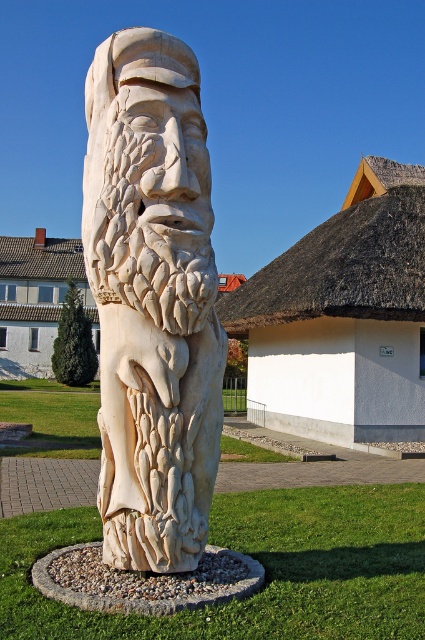
Can you confirm if white carved wood statue at center is smaller than white tiled roof at upper center?

Yes, white carved wood statue at center is smaller than white tiled roof at upper center.

Is point (147, 104) more distant than point (48, 273)?

No, (147, 104) is closer to viewer.

Where is `white carved wood statue at center`? white carved wood statue at center is located at coordinates click(x=152, y=300).

Can you confirm if white thatched roof at upper center is taller than white tiled roof at upper center?

In fact, white thatched roof at upper center may be shorter than white tiled roof at upper center.

Is point (416, 372) closer to viewer compared to point (34, 282)?

Yes, it is.

Which is in front, point (294, 388) or point (61, 292)?

Point (294, 388) is in front.

The height and width of the screenshot is (640, 425). In order to click on white thatched roof at upper center in this screenshot , I will do `click(342, 316)`.

Is white carved wood statue at center taller than white thatched roof at upper center?

No, white carved wood statue at center is not taller than white thatched roof at upper center.

Describe the element at coordinates (152, 300) in the screenshot. Image resolution: width=425 pixels, height=640 pixels. I see `white carved wood statue at center` at that location.

At what (x,y) coordinates should I click in order to perform the action: click on white carved wood statue at center. Please return your answer as a coordinate pair (x, y). This screenshot has width=425, height=640. Looking at the image, I should click on (152, 300).